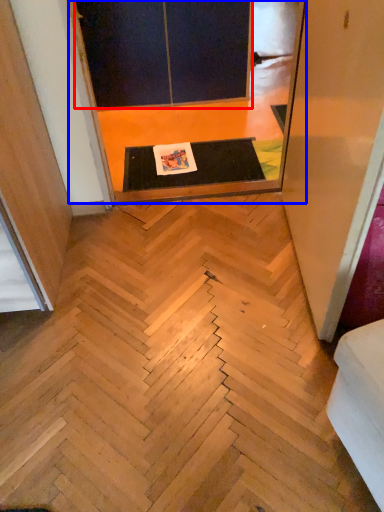
Question: Which point is closer to the camera, screen door (highlighted by a red box) or screen door (highlighted by a blue box)?

Choices:
 (A) screen door
 (B) screen door

Answer: (B)